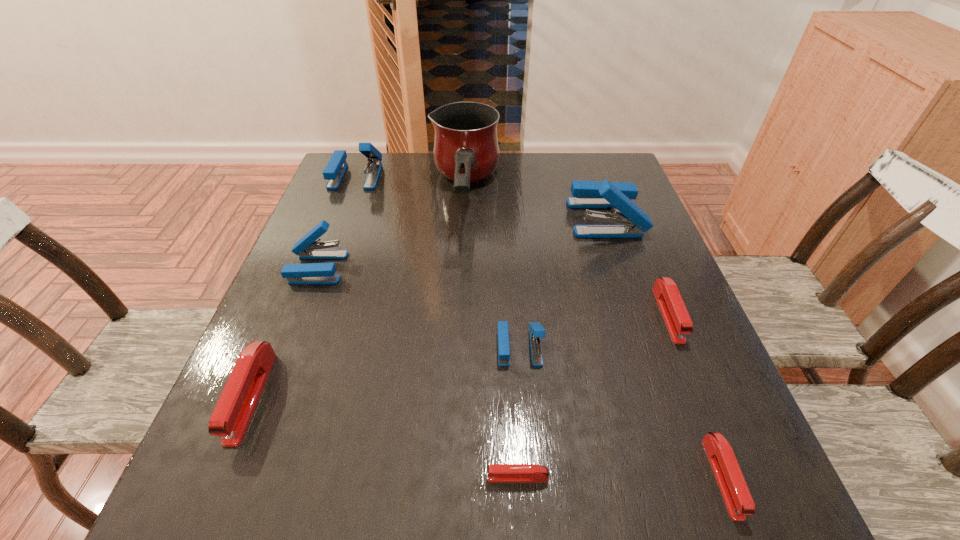
Image resolution: width=960 pixels, height=540 pixels. I want to click on red stapler that can be found as the second closest to the second shortest stapler, so click(x=497, y=473).

This screenshot has width=960, height=540. In order to click on the fourth closest red stapler to the rightmost blue stapler in this screenshot , I will do `click(235, 407)`.

Find the location of `free location that satisfies the following two spatial constraints: 1. on the back side of the biggest blue stapler; 2. on the left side of the smallest blue stapler`. free location that satisfies the following two spatial constraints: 1. on the back side of the biggest blue stapler; 2. on the left side of the smallest blue stapler is located at coordinates (509, 218).

Identify the location of vacant position in the image that satisfies the following two spatial constraints: 1. on the back side of the third tallest stapler; 2. on the left side of the rightmost blue stapler. This screenshot has height=540, width=960. (337, 218).